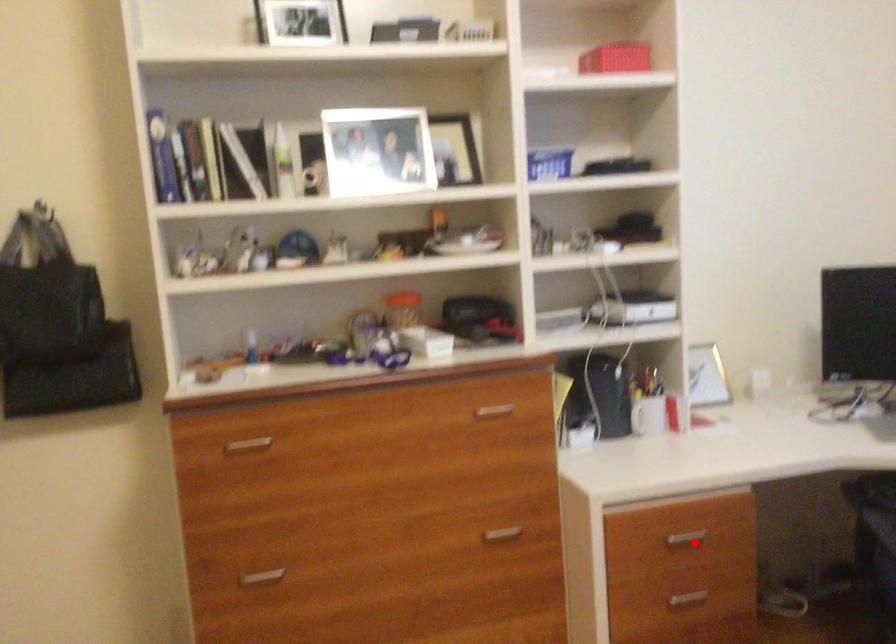
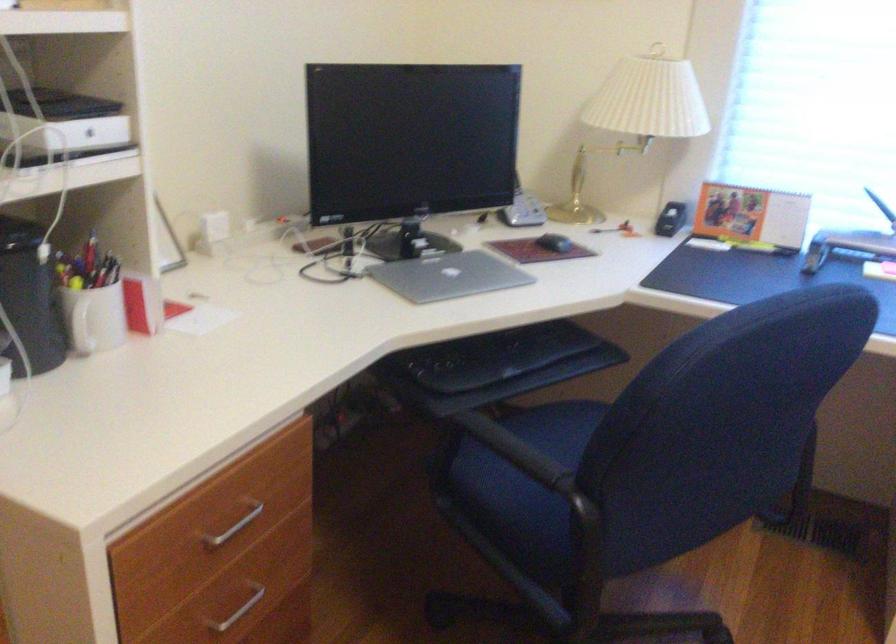
Where in the second image is the point corresponding to the highlighted location from the first image?

(231, 527)